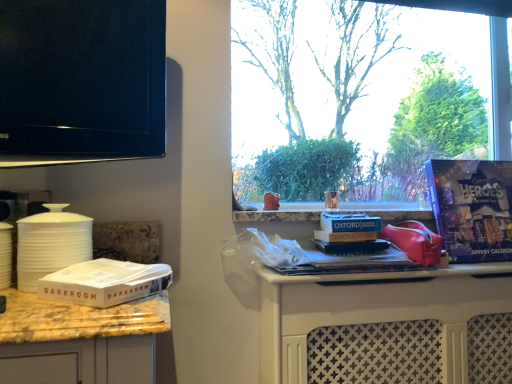
Question: Considering the relative sizes of black glossy tv at upper left and white cardboard box at lower left in the image provided, is black glossy tv at upper left wider than white cardboard box at lower left?

Choices:
 (A) yes
 (B) no

Answer: (B)

Question: Does black glossy tv at upper left have a smaller size compared to white cardboard box at lower left?

Choices:
 (A) no
 (B) yes

Answer: (A)

Question: Is black glossy tv at upper left looking in the opposite direction of white cardboard box at lower left?

Choices:
 (A) yes
 (B) no

Answer: (B)

Question: Is black glossy tv at upper left beside white cardboard box at lower left?

Choices:
 (A) no
 (B) yes

Answer: (A)

Question: Does black glossy tv at upper left have a larger size compared to white cardboard box at lower left?

Choices:
 (A) no
 (B) yes

Answer: (B)

Question: Considering the relative positions of white cardboard box at lower left and white plastic bag at center in the image provided, is white cardboard box at lower left to the left or to the right of white plastic bag at center?

Choices:
 (A) left
 (B) right

Answer: (A)

Question: Considering the positions of point (94, 296) and point (382, 203), is point (94, 296) closer or farther from the camera than point (382, 203)?

Choices:
 (A) farther
 (B) closer

Answer: (B)

Question: Looking at the image, does white cardboard box at lower left seem bigger or smaller compared to white plastic bag at center?

Choices:
 (A) small
 (B) big

Answer: (A)

Question: Is white cardboard box at lower left inside or outside of white plastic bag at center?

Choices:
 (A) outside
 (B) inside

Answer: (A)

Question: From a real-world perspective, relative to white matte canister at left, is white plastic bag at center vertically above or below?

Choices:
 (A) below
 (B) above

Answer: (B)

Question: Is white plastic bag at center bigger or smaller than white matte canister at left?

Choices:
 (A) big
 (B) small

Answer: (A)

Question: Is white plastic bag at center in front of or behind white matte canister at left in the image?

Choices:
 (A) front
 (B) behind

Answer: (B)

Question: Would you say white plastic bag at center is to the left or to the right of white matte canister at left in the picture?

Choices:
 (A) left
 (B) right

Answer: (B)

Question: Is white matte canister at left situated inside black glossy tv at upper left or outside?

Choices:
 (A) outside
 (B) inside

Answer: (A)

Question: Is point (22, 261) positioned closer to the camera than point (109, 110)?

Choices:
 (A) closer
 (B) farther

Answer: (A)